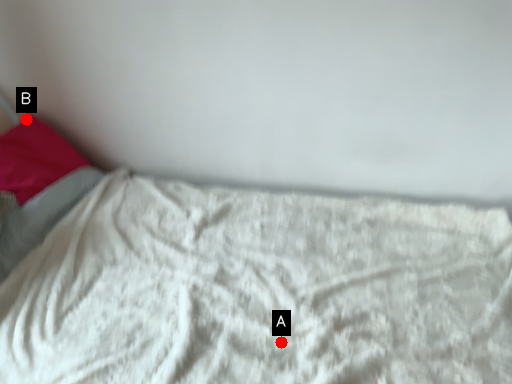
Question: Two points are circled on the image, labeled by A and B beside each circle. Among these points, which one is farthest from the camera?

Choices:
 (A) A is further
 (B) B is further

Answer: (B)